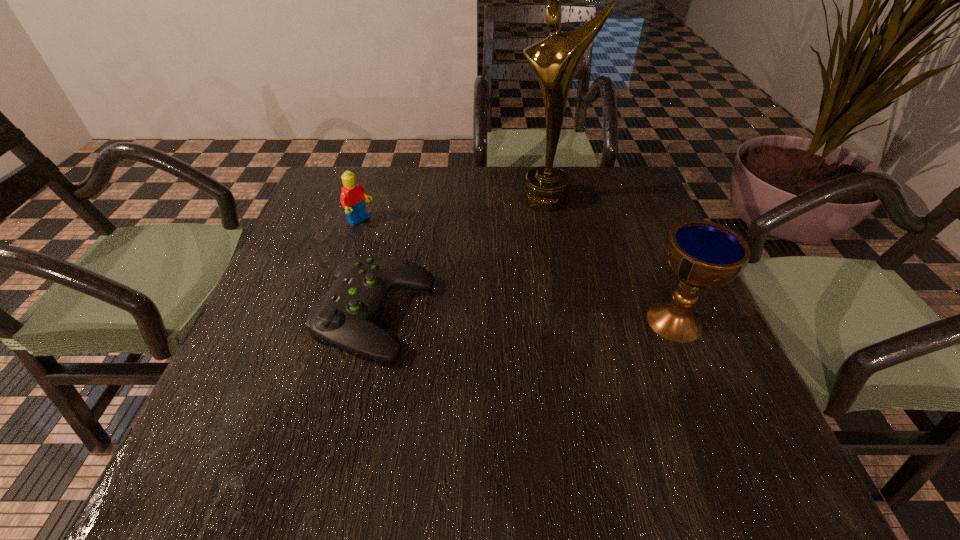
I want to click on control, so coord(343,316).

The image size is (960, 540). Find the location of `the rightmost object`. the rightmost object is located at coordinates (703, 254).

The width and height of the screenshot is (960, 540). Identify the location of chalice. (703, 254).

Find the location of a particular element. The width and height of the screenshot is (960, 540). the second farthest object is located at coordinates (352, 198).

Image resolution: width=960 pixels, height=540 pixels. In order to click on the second shortest object in this screenshot , I will do `click(352, 198)`.

Where is `the third object from left to right`? This screenshot has height=540, width=960. the third object from left to right is located at coordinates (554, 60).

What are the coordinates of `the farthest object` in the screenshot? It's located at (554, 60).

Find the location of `free location located 0.180m on the back of the shortest object`. free location located 0.180m on the back of the shortest object is located at coordinates (396, 224).

The width and height of the screenshot is (960, 540). I want to click on free space located on the left of the third shortest object, so click(474, 321).

Locate an element on the screen. This screenshot has width=960, height=540. free region located on the face of the Lego is located at coordinates (414, 254).